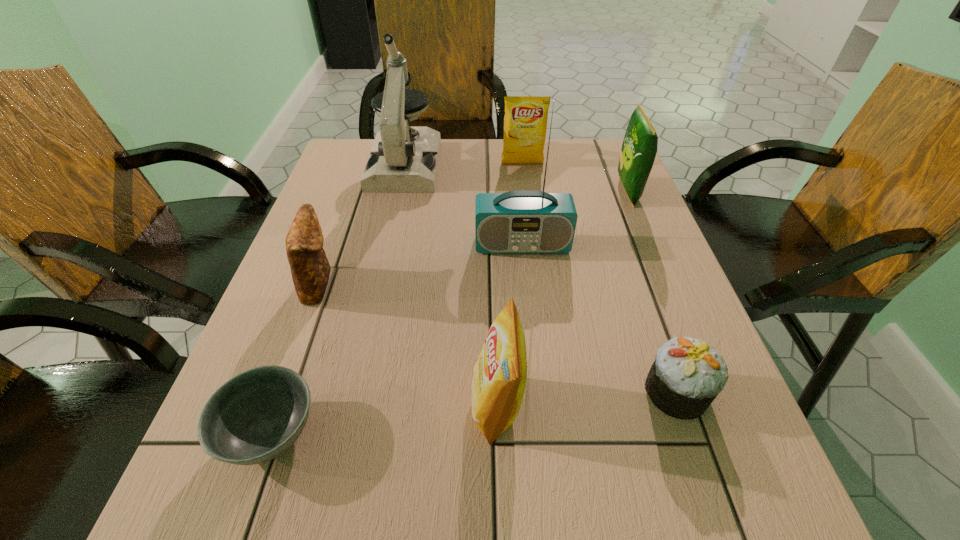
In order to click on microscope in this screenshot , I will do `click(403, 159)`.

At what (x,y) coordinates should I click in order to perform the action: click on the fifth nearest object. Please return your answer as a coordinate pair (x, y). The width and height of the screenshot is (960, 540). Looking at the image, I should click on (525, 221).

This screenshot has height=540, width=960. In order to click on the rightmost crisp (potato chip) in this screenshot , I will do `click(639, 148)`.

Identify the location of the farthest crisp (potato chip). This screenshot has height=540, width=960. (525, 122).

Where is `the nearest crisp (potato chip)`? This screenshot has width=960, height=540. the nearest crisp (potato chip) is located at coordinates pos(499,376).

Where is `the sixth tallest object`? The height and width of the screenshot is (540, 960). the sixth tallest object is located at coordinates (310, 269).

The image size is (960, 540). I want to click on clutch bag, so 310,269.

Identify the location of cupcake. This screenshot has height=540, width=960. (687, 375).

Where is `bowl`? This screenshot has height=540, width=960. bowl is located at coordinates (255, 416).

Locate an element on the screen. vacant point located at the eyepiece of the microscope is located at coordinates (376, 288).